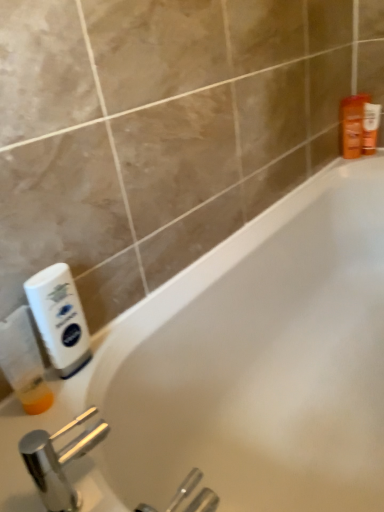
Question: From a real-world perspective, relative to translucent plastic bottle at left, positioned as the second cleaning product in right-to-left order, is white plastic bottle at left, the 1th cleaning product in the right-to-left sequence, vertically above or below?

Choices:
 (A) above
 (B) below

Answer: (A)

Question: Does point (64, 355) appear closer or farther from the camera than point (23, 322)?

Choices:
 (A) closer
 (B) farther

Answer: (B)

Question: Which of these objects is positioned farthest from the white plastic bottle at left, the 1th cleaning product in the right-to-left sequence?

Choices:
 (A) white glossy bathtub at center
 (B) translucent plastic bottle at left, acting as the 1th cleaning product starting from the left
 (C) orange plastic bottle at upper right, which appears as the 2th toiletry when viewed from the right
 (D) polished chrome faucet at lower left
 (E) orange matte lotion at upper right, marked as the 1th toiletry in a right-to-left arrangement

Answer: (E)

Question: Which object is positioned farthest from the orange plastic bottle at upper right, the 1th toiletry viewed from the left?

Choices:
 (A) translucent plastic bottle at left, acting as the 1th cleaning product starting from the left
 (B) white glossy bathtub at center
 (C) white plastic bottle at left, the 1th cleaning product in the right-to-left sequence
 (D) orange matte lotion at upper right, marked as the 1th toiletry in a right-to-left arrangement
 (E) polished chrome faucet at lower left

Answer: (E)